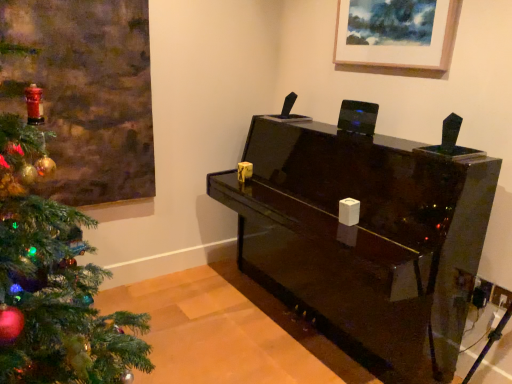
At what (x,y) coordinates should I click in order to perform the action: click on free space to the left of glossy black piano at center. Please return your answer as a coordinate pair (x, y). Looking at the image, I should click on (188, 326).